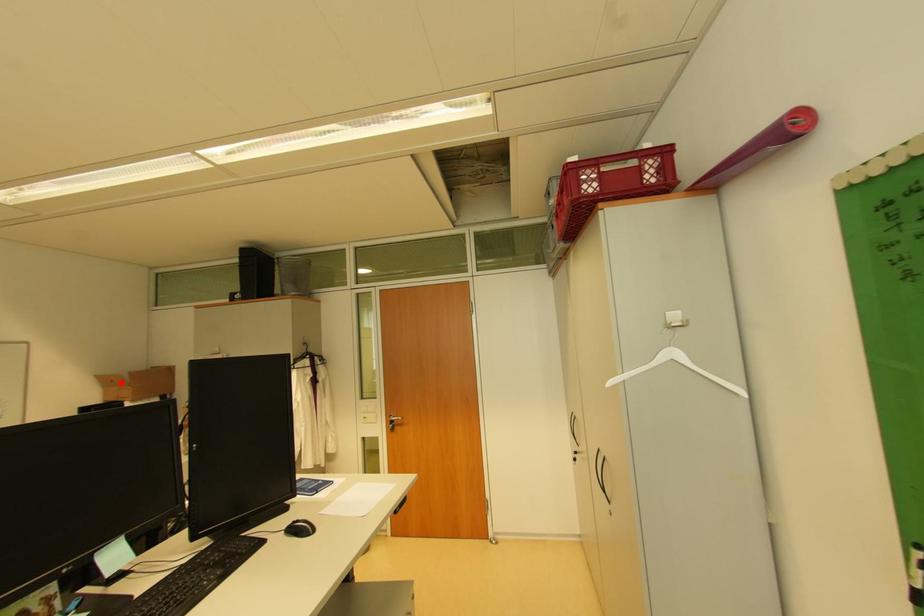
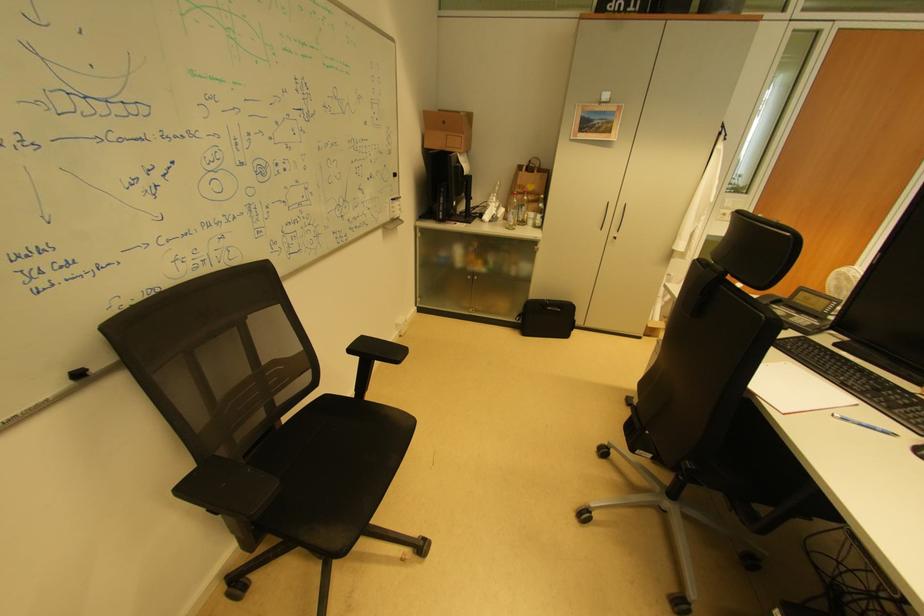
The point at the highlighted location is marked in the first image. Where is the corresponding point in the second image?

(453, 124)